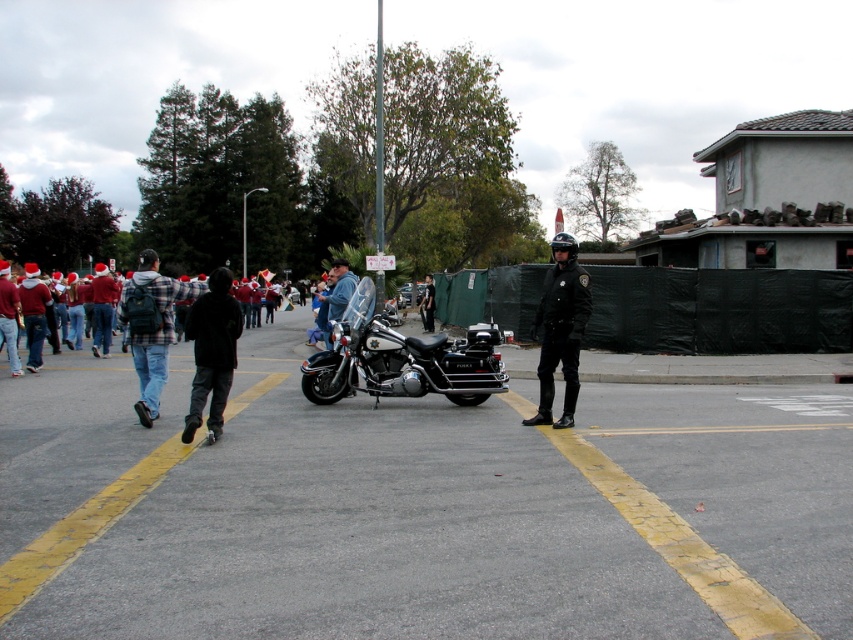
You are a photographer positioned at the center of the scene. You want to take a photo of the shiny chrome motorcycle at center and the denim jacket at center. Which object should you move towards first to get both in the frame?

The shiny chrome motorcycle at center is to the right of the denim jacket at center. Since you are at the center, you should move towards the denim jacket at center first to ensure both objects are in the frame.

You are a photographer trying to capture the festive crowd in the background while standing near the police officer and motorcycle. You notice two points marked in the scene. Which point, point (312, 388) or point (549, 362), is closer to you as you stand at your current position?

Point (312, 388) is closer to you because it is further to the viewer than point (549, 362).